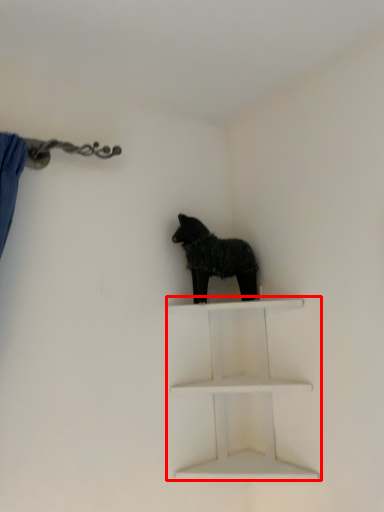
Question: Observing the image, what is the correct spatial positioning of shelf (annotated by the red box) in reference to dog?

Choices:
 (A) left
 (B) right

Answer: (B)